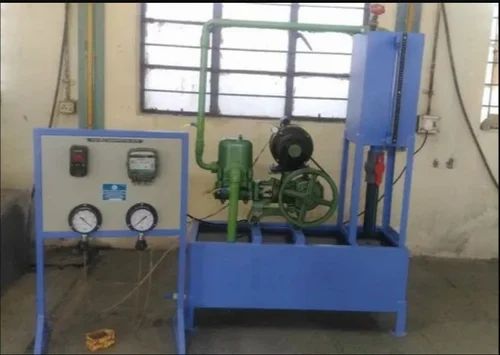
Locate an element on the screen. wall is located at coordinates (443, 178).